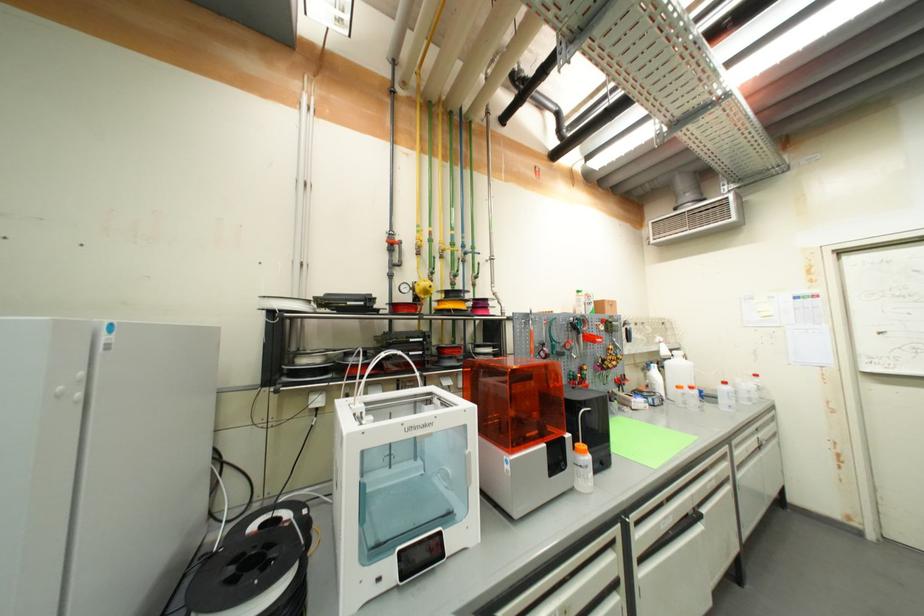
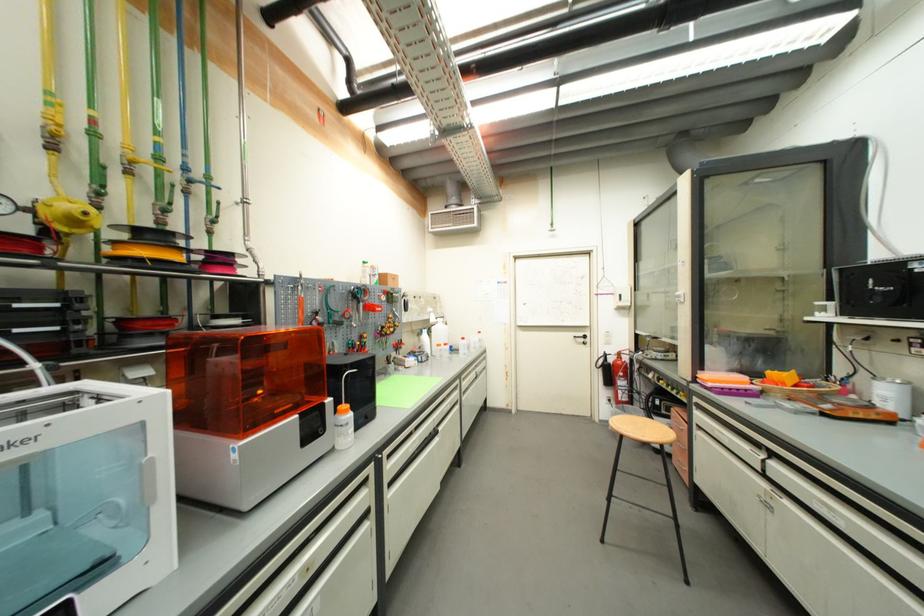
Question: The first image is from the beginning of the video and the second image is from the end. How did the camera likely rotate when shooting the video?

Choices:
 (A) Left
 (B) Right
 (C) Up
 (D) Down

Answer: (B)